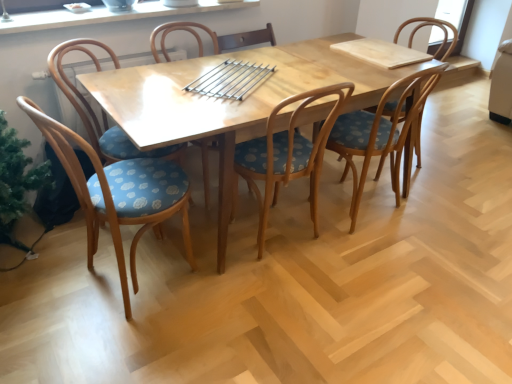
You are a GUI agent. You are given a task and a screenshot of the screen. Output one action in this format:
    pyautogui.click(x=<x>, y=<y>)
    Task: Click on the free space in front of wooden chair with blue polka dot seat at center, which ranks as the 3th chair in right-to-left order
    The width and height of the screenshot is (512, 384).
    Given the screenshot: What is the action you would take?
    pyautogui.click(x=281, y=286)